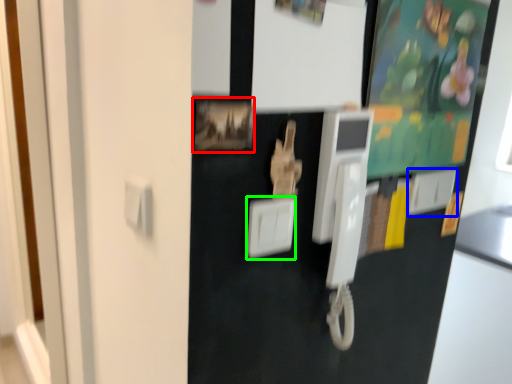
Question: Which object is the farthest from picture frame (highlighted by a red box)? Choose among these: light switch (highlighted by a blue box) or light switch (highlighted by a green box).

Choices:
 (A) light switch
 (B) light switch

Answer: (A)